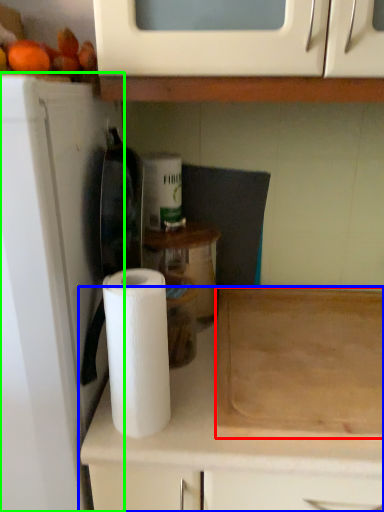
Question: Which is nearer to the cutting board (highlighted by a red box)? cabinetry (highlighted by a blue box) or appliance (highlighted by a green box).

Choices:
 (A) cabinetry
 (B) appliance

Answer: (A)